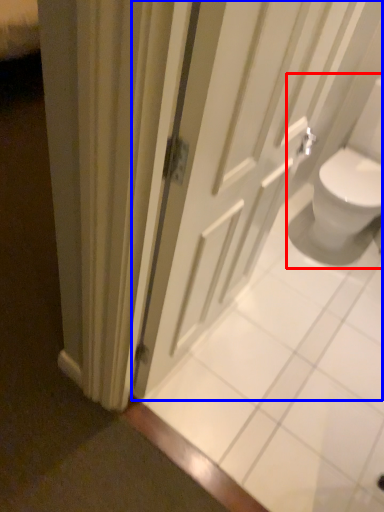
Question: Which of the following is the farthest to the observer, sink (highlighted by a red box) or door (highlighted by a blue box)?

Choices:
 (A) sink
 (B) door

Answer: (A)